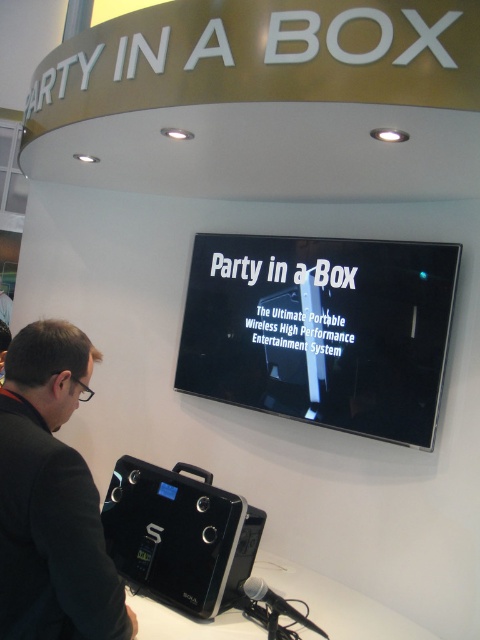
You are at the trade show booth and want to see both the black glossy sign at center and the black fabric jacket at lower left. Which object should you look at first to ensure you can see both without moving your head?

You should look at the black glossy sign at center first because it is larger and will be easier to see from a distance, allowing you to view both objects without moving your head.

You are at the trade show booth and want to locate the black glossy sign at center and the black plastic speaker at lower center. Which object is positioned to the right of the other?

The black glossy sign at center is to the right of the black plastic speaker at lower center.